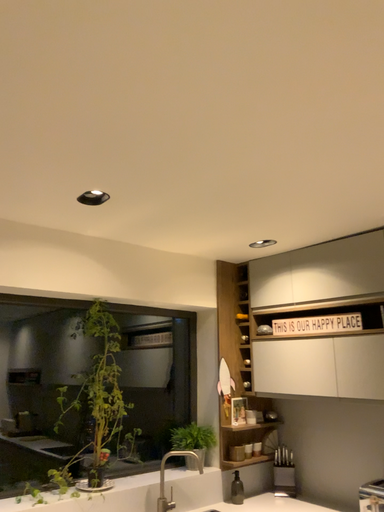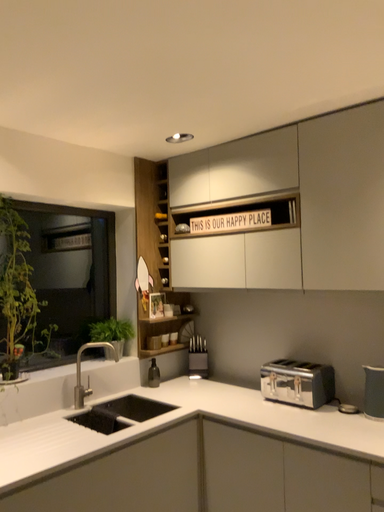
Question: Which way did the camera rotate in the video?

Choices:
 (A) rotated downward
 (B) rotated upward

Answer: (A)